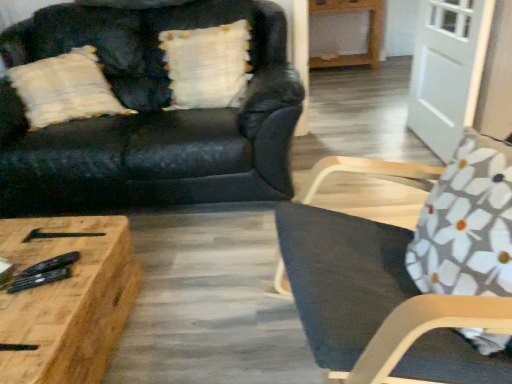
Question: Is wooden coffee table at lower left bigger or smaller than matte black couch at upper left?

Choices:
 (A) small
 (B) big

Answer: (A)

Question: In terms of height, does wooden coffee table at lower left look taller or shorter compared to matte black couch at upper left?

Choices:
 (A) short
 (B) tall

Answer: (A)

Question: Considering the real-world distances, which object is farthest from the floral fabric cushion at right?

Choices:
 (A) wooden coffee table at lower left
 (B) dark gray fabric chair at right
 (C) matte black couch at upper left
 (D) light brown wooden table at upper right
 (E) white textured pillow at upper center

Answer: (D)

Question: Considering the real-world distances, which object is closest to the white textured pillow at upper center?

Choices:
 (A) light brown wooden table at upper right
 (B) white glossy door at upper right
 (C) matte black couch at upper left
 (D) dark gray fabric chair at right
 (E) wooden coffee table at lower left

Answer: (C)